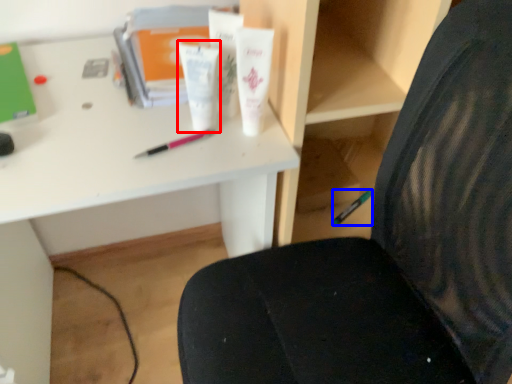
Question: Which point is further to the camera, toiletry (highlighted by a red box) or stationery (highlighted by a blue box)?

Choices:
 (A) toiletry
 (B) stationery

Answer: (B)